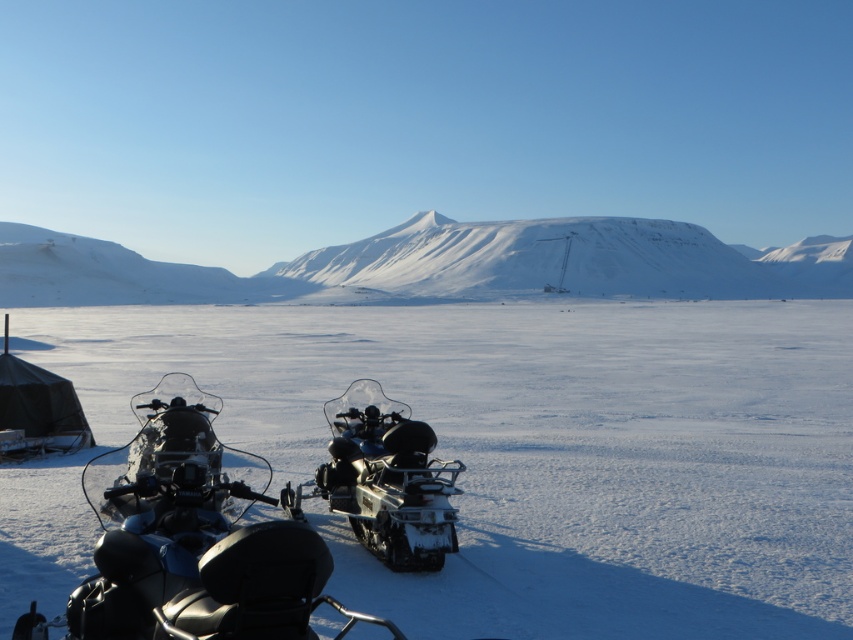
Question: Does white matte snow at center appear over snowy white mountain at center?

Choices:
 (A) yes
 (B) no

Answer: (B)

Question: Which object is the closest to the black rubber snowmobile at center?

Choices:
 (A) black matte snowmobile at center
 (B) white matte snow at center

Answer: (A)

Question: Does black matte snowmobile at center have a smaller size compared to black rubber snowmobile at center?

Choices:
 (A) no
 (B) yes

Answer: (B)

Question: Is snowy white mountain at center positioned before black matte snowmobile at center?

Choices:
 (A) yes
 (B) no

Answer: (B)

Question: Which point is farther to the camera?

Choices:
 (A) (538, 397)
 (B) (204, 500)
 (C) (428, 435)

Answer: (A)

Question: Among these objects, which one is farthest from the camera?

Choices:
 (A) snowy white mountain at center
 (B) black rubber snowmobile at center
 (C) white matte snow at center

Answer: (A)